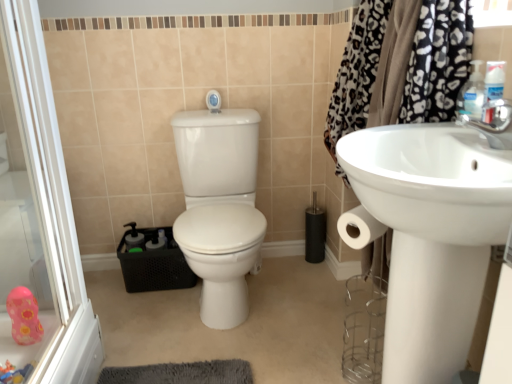
I want to click on vacant space in front of white glossy toilet at center, so click(x=217, y=361).